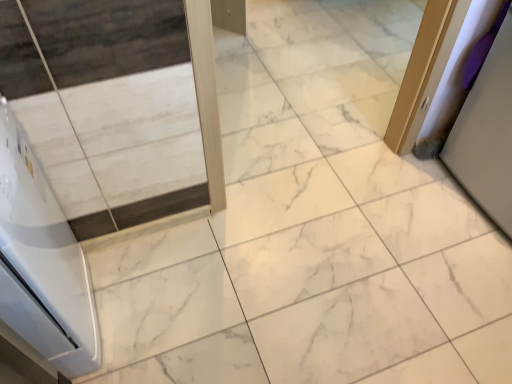
The width and height of the screenshot is (512, 384). What do you see at coordinates (42, 262) in the screenshot?
I see `white glossy refrigerator at left` at bounding box center [42, 262].

Image resolution: width=512 pixels, height=384 pixels. What are the coordinates of `white glossy refrigerator at left` in the screenshot? It's located at (42, 262).

Find the location of `white glossy refrigerator at left`. white glossy refrigerator at left is located at coordinates (42, 262).